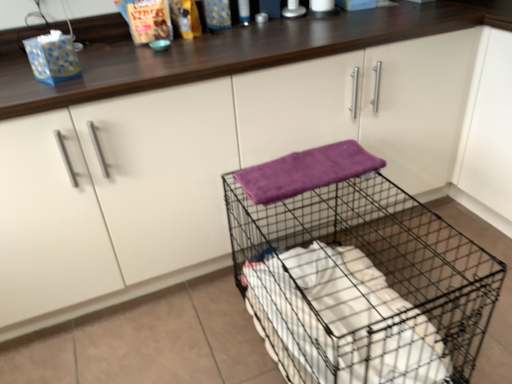
In order to face black wire mesh trolley at center, should I rotate leftwards or rightwards?

Rotate your view right by about 10.668°.

Where is `black wire mesh trolley at center`? This screenshot has width=512, height=384. black wire mesh trolley at center is located at coordinates (x=356, y=272).

This screenshot has width=512, height=384. What do you see at coordinates (356, 272) in the screenshot? I see `black wire mesh trolley at center` at bounding box center [356, 272].

At what (x,y) coordinates should I click in order to perform the action: click on purple soft towel at center. Please return your answer as a coordinate pair (x, y). Image resolution: width=512 pixels, height=384 pixels. Looking at the image, I should click on (306, 171).

Describe the element at coordinates (306, 171) in the screenshot. I see `purple soft towel at center` at that location.

You are a GUI agent. You are given a task and a screenshot of the screen. Output one action in this format:
    pyautogui.click(x=<x>, y=<y>)
    Task: Click on the black wire mesh trolley at center
    The height and width of the screenshot is (384, 512).
    Given the screenshot: What is the action you would take?
    pyautogui.click(x=356, y=272)

Based on their positions, is black wire mesh trolley at center located to the left or right of purple soft towel at center?

black wire mesh trolley at center is positioned on purple soft towel at center's right side.

Is black wire mesh trolley at center positioned behind purple soft towel at center?

No, black wire mesh trolley at center is closer to the camera.

Considering the positions of point (285, 281) and point (277, 164), is point (285, 281) closer or farther from the camera than point (277, 164)?

Point (285, 281) appears to be farther away from the viewer than point (277, 164).

From the image's perspective, which one is positioned higher, black wire mesh trolley at center or purple soft towel at center?

From the image's view, purple soft towel at center is above.

From a real-world perspective, is black wire mesh trolley at center physically below purple soft towel at center?

Yes, from a real-world perspective, black wire mesh trolley at center is under purple soft towel at center.

Between black wire mesh trolley at center and purple soft towel at center, which one has larger width?

With larger width is black wire mesh trolley at center.

Considering the relative sizes of black wire mesh trolley at center and purple soft towel at center in the image provided, is black wire mesh trolley at center shorter than purple soft towel at center?

Incorrect, the height of black wire mesh trolley at center does not fall short of that of purple soft towel at center.

Consider the image. Based on their sizes in the image, would you say black wire mesh trolley at center is bigger or smaller than purple soft towel at center?

black wire mesh trolley at center is bigger than purple soft towel at center.

Is black wire mesh trolley at center completely or partially outside of purple soft towel at center?

Yes, black wire mesh trolley at center is not within purple soft towel at center.

Is black wire mesh trolley at center not near purple soft towel at center?

That's not correct — black wire mesh trolley at center is a little close to purple soft towel at center.

Is black wire mesh trolley at center facing towards purple soft towel at center?

No, black wire mesh trolley at center is not facing towards purple soft towel at center.

Identify the location of trolley below the purple soft towel at center (from the image's perspective). Image resolution: width=512 pixels, height=384 pixels. (356, 272).

Can you confirm if purple soft towel at center is positioned to the left of black wire mesh trolley at center?

Yes.

Considering their positions, is purple soft towel at center located in front of or behind black wire mesh trolley at center?

In the image, purple soft towel at center appears behind black wire mesh trolley at center.

Is point (273, 179) in front of point (342, 229)?

Yes, it is.

From the image's perspective, is purple soft towel at center on black wire mesh trolley at center?

Yes, from the image's perspective, purple soft towel at center is above black wire mesh trolley at center.

From a real-world perspective, is purple soft towel at center above or below black wire mesh trolley at center?

purple soft towel at center is situated higher than black wire mesh trolley at center in the real world.

Which object is wider, purple soft towel at center or black wire mesh trolley at center?

black wire mesh trolley at center is wider.

Who is shorter, purple soft towel at center or black wire mesh trolley at center?

purple soft towel at center.

Which of these two, purple soft towel at center or black wire mesh trolley at center, is bigger?

black wire mesh trolley at center.

Would you say purple soft towel at center contains black wire mesh trolley at center?

No, black wire mesh trolley at center is located outside of purple soft towel at center.

Is purple soft towel at center directly adjacent to black wire mesh trolley at center?

There is a gap between purple soft towel at center and black wire mesh trolley at center.

Based on the photo, is purple soft towel at center aimed at black wire mesh trolley at center?

No, purple soft towel at center is not facing towards black wire mesh trolley at center.

What are the coordinates of `trolley in front of the purple soft towel at center` in the screenshot? It's located at (356, 272).

The width and height of the screenshot is (512, 384). I want to click on trolley on the right of purple soft towel at center, so click(356, 272).

Locate an element on the screen. bath towel that appears above the black wire mesh trolley at center (from the image's perspective) is located at coordinates (306, 171).